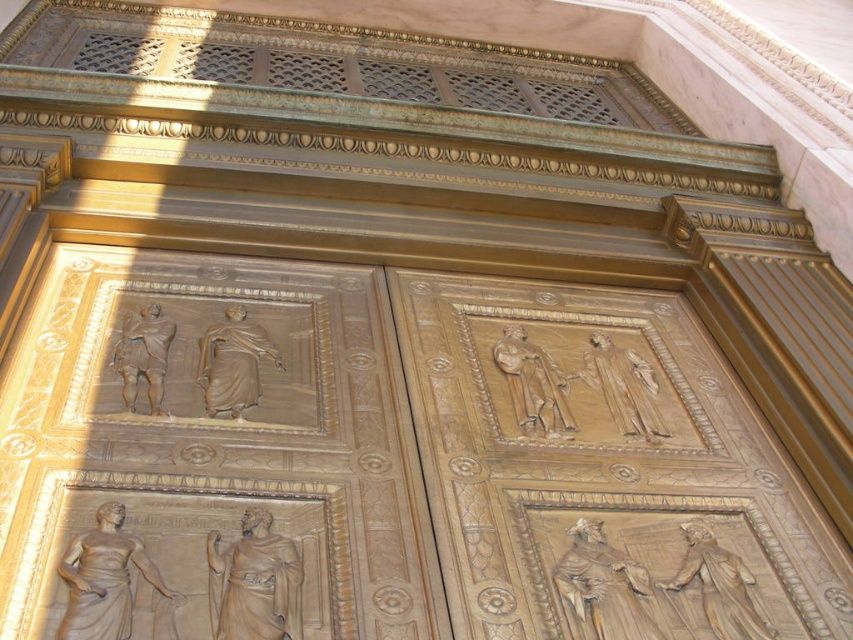
Question: Which point is farther to the camera?

Choices:
 (A) (718, 586)
 (B) (123, 394)

Answer: (B)

Question: Is golden bronze statue at lower left wider than golden bronze relief at upper left?

Choices:
 (A) yes
 (B) no

Answer: (A)

Question: Can you confirm if polished bronze relief at lower right is smaller than matte bronze relief at upper right?

Choices:
 (A) no
 (B) yes

Answer: (B)

Question: Among these objects, which one is nearest to the camera?

Choices:
 (A) golden bronze relief at lower right
 (B) golden bronze statue at center
 (C) matte bronze statue at lower left

Answer: (C)

Question: Does golden bronze statue at lower left have a larger size compared to golden bronze relief at lower right?

Choices:
 (A) yes
 (B) no

Answer: (A)

Question: Which point is closer to the camera taking this photo?

Choices:
 (A) (250, 541)
 (B) (105, 550)
 (C) (212, 360)
 (D) (134, 342)

Answer: (B)